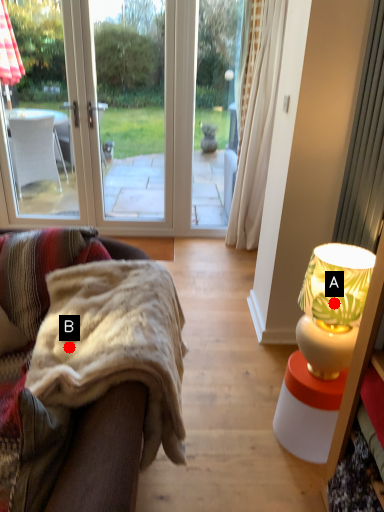
Question: Two points are circled on the image, labeled by A and B beside each circle. Which point is closer to the camera?

Choices:
 (A) A is closer
 (B) B is closer

Answer: (B)